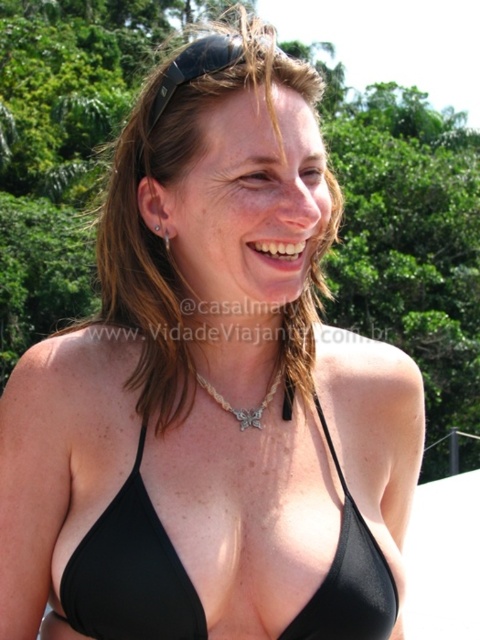
Is silver metallic chain at center thinner than silver metallic earring at upper left?

No, silver metallic chain at center is not thinner than silver metallic earring at upper left.

Can you confirm if silver metallic chain at center is wider than silver metallic earring at upper left?

Yes.

Who is more forward, (252, 424) or (164, 228)?

Positioned in front is point (164, 228).

Image resolution: width=480 pixels, height=640 pixels. I want to click on silver metallic chain at center, so click(243, 406).

Between brownhair at center and silver metallic chain at center, which one is positioned lower?

silver metallic chain at center is below.

The width and height of the screenshot is (480, 640). In order to click on brownhair at center in this screenshot , I will do `click(163, 186)`.

Is black fabric bikini top at center thinner than silver metallic earring at upper left?

No.

How much distance is there between black fabric bikini top at center and silver metallic earring at upper left?

A distance of 30.07 inches exists between black fabric bikini top at center and silver metallic earring at upper left.

Does point (342, 608) lie in front of point (164, 237)?

That is True.

Locate an element on the screen. The width and height of the screenshot is (480, 640). black fabric bikini top at center is located at coordinates (130, 573).